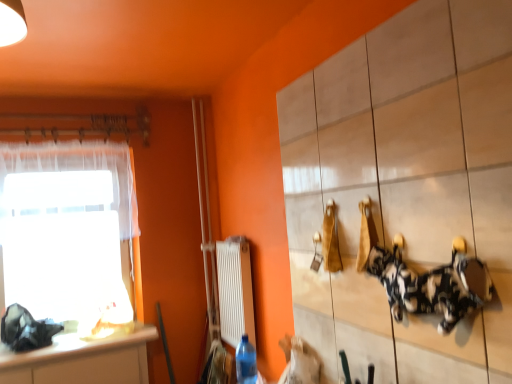
Question: Should I look upward or downward to see white tile cabinet at upper right?

Choices:
 (A) down
 (B) up

Answer: (A)

Question: Can you confirm if white glossy countertop at lower left is positioned to the right of transparent fabric at left?

Choices:
 (A) yes
 (B) no

Answer: (A)

Question: Is the depth of white glossy countertop at lower left greater than that of transparent fabric at left?

Choices:
 (A) yes
 (B) no

Answer: (B)

Question: Does white glossy countertop at lower left have a greater width compared to transparent fabric at left?

Choices:
 (A) no
 (B) yes

Answer: (B)

Question: Is white glossy countertop at lower left facing away from transparent fabric at left?

Choices:
 (A) no
 (B) yes

Answer: (B)

Question: Does white glossy countertop at lower left have a lesser width compared to transparent fabric at left?

Choices:
 (A) yes
 (B) no

Answer: (B)

Question: From the image's perspective, would you say white glossy countertop at lower left is positioned over transparent fabric at left?

Choices:
 (A) yes
 (B) no

Answer: (B)

Question: Considering the relative positions of transparent fabric at left and white sheer curtain at left in the image provided, is transparent fabric at left behind white sheer curtain at left?

Choices:
 (A) no
 (B) yes

Answer: (B)

Question: Can you confirm if transparent fabric at left is positioned to the left of white sheer curtain at left?

Choices:
 (A) no
 (B) yes

Answer: (B)

Question: From the image's perspective, is transparent fabric at left below white sheer curtain at left?

Choices:
 (A) no
 (B) yes

Answer: (B)

Question: Is transparent fabric at left far away from white sheer curtain at left?

Choices:
 (A) yes
 (B) no

Answer: (B)

Question: Could you tell me if transparent fabric at left is turned towards white sheer curtain at left?

Choices:
 (A) no
 (B) yes

Answer: (B)

Question: From the image's perspective, is transparent fabric at left on white sheer curtain at left?

Choices:
 (A) no
 (B) yes

Answer: (A)

Question: Does white tile cabinet at upper right have a lesser width compared to blue plastic bottle at lower center?

Choices:
 (A) yes
 (B) no

Answer: (A)